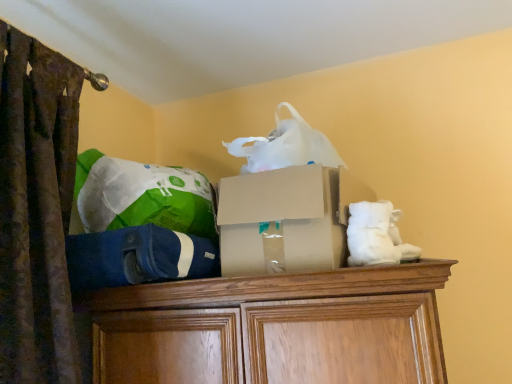
Question: Is green fabric bean bag chair at upper left, which is the first bean bag chair in top-to-bottom order, looking in the opposite direction of blue fabric bean bag chair at center, which is the first bean bag chair in bottom-to-top order?

Choices:
 (A) no
 (B) yes

Answer: (A)

Question: Can you confirm if green fabric bean bag chair at upper left, which is the first bean bag chair in top-to-bottom order, is smaller than blue fabric bean bag chair at center, acting as the second bean bag chair starting from the top?

Choices:
 (A) yes
 (B) no

Answer: (B)

Question: From a real-world perspective, is green fabric bean bag chair at upper left, positioned as the second bean bag chair in bottom-to-top order, positioned over blue fabric bean bag chair at center, acting as the second bean bag chair starting from the top, based on gravity?

Choices:
 (A) yes
 (B) no

Answer: (A)

Question: From a real-world perspective, is green fabric bean bag chair at upper left, positioned as the second bean bag chair in bottom-to-top order, located beneath blue fabric bean bag chair at center, acting as the second bean bag chair starting from the top?

Choices:
 (A) yes
 (B) no

Answer: (B)

Question: Are green fabric bean bag chair at upper left, positioned as the second bean bag chair in bottom-to-top order, and blue fabric bean bag chair at center, acting as the second bean bag chair starting from the top, making contact?

Choices:
 (A) yes
 (B) no

Answer: (B)

Question: From the image's perspective, does green fabric bean bag chair at upper left, positioned as the second bean bag chair in bottom-to-top order, appear lower than blue fabric bean bag chair at center, acting as the second bean bag chair starting from the top?

Choices:
 (A) yes
 (B) no

Answer: (B)

Question: Does cardboard box at center have a smaller size compared to green fabric bean bag chair at upper left, positioned as the second bean bag chair in bottom-to-top order?

Choices:
 (A) yes
 (B) no

Answer: (B)

Question: From the image's perspective, does cardboard box at center appear lower than green fabric bean bag chair at upper left, positioned as the second bean bag chair in bottom-to-top order?

Choices:
 (A) no
 (B) yes

Answer: (B)

Question: Can you confirm if cardboard box at center is wider than green fabric bean bag chair at upper left, which is the first bean bag chair in top-to-bottom order?

Choices:
 (A) yes
 (B) no

Answer: (A)

Question: Is cardboard box at center positioned far away from green fabric bean bag chair at upper left, which is the first bean bag chair in top-to-bottom order?

Choices:
 (A) yes
 (B) no

Answer: (B)

Question: Considering the relative positions of cardboard box at center and green fabric bean bag chair at upper left, which is the first bean bag chair in top-to-bottom order, in the image provided, is cardboard box at center to the right of green fabric bean bag chair at upper left, which is the first bean bag chair in top-to-bottom order, from the viewer's perspective?

Choices:
 (A) no
 (B) yes

Answer: (B)

Question: From the image's perspective, would you say cardboard box at center is positioned over green fabric bean bag chair at upper left, which is the first bean bag chair in top-to-bottom order?

Choices:
 (A) yes
 (B) no

Answer: (B)

Question: Is cardboard box at center located within blue fabric bean bag chair at center, which is the first bean bag chair in bottom-to-top order?

Choices:
 (A) no
 (B) yes

Answer: (A)